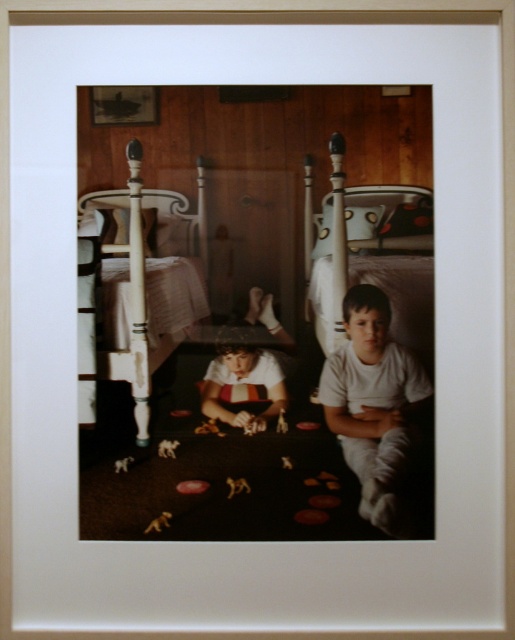
Question: Which point is farther from the camera taking this photo?

Choices:
 (A) (420, 435)
 (B) (260, 300)
 (C) (146, 317)
 (D) (230, 486)

Answer: (B)

Question: Which point appears farthest from the camera in this image?

Choices:
 (A) (190, 285)
 (B) (247, 316)
 (C) (231, 484)

Answer: (B)

Question: Which of these objects is positioned farthest from the white plastic toy at center?

Choices:
 (A) white painted wood bed at left
 (B) striped t-shirt at center
 (C) brown fuzzy stuffed animal at lower center

Answer: (A)

Question: Can you confirm if white cotton shirt at center is positioned above brown fuzzy stuffed animal at lower center?

Choices:
 (A) no
 (B) yes

Answer: (B)

Question: Is white painted wood bed at left closer to camera compared to brown fuzzy stuffed animal at lower center?

Choices:
 (A) yes
 (B) no

Answer: (A)

Question: Is white cotton shirt at center smaller than brown fuzzy stuffed animal at lower center?

Choices:
 (A) yes
 (B) no

Answer: (B)